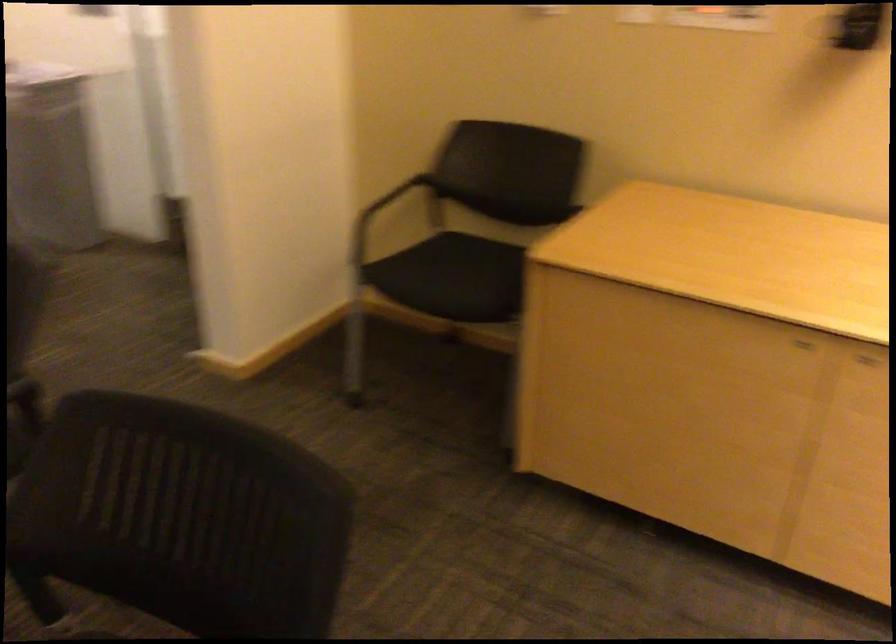
Where would you sit the black chair sitting surface? Please return your answer as a coordinate pair (x, y).

(446, 275)